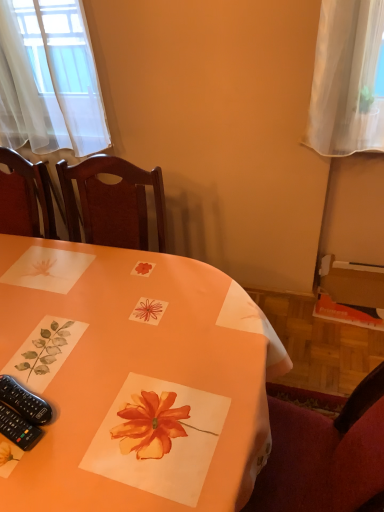
Where is `free space to the right of black plastic remote control at lower left, which is counted as the first remote control, starting from the top`? The image size is (384, 512). free space to the right of black plastic remote control at lower left, which is counted as the first remote control, starting from the top is located at coordinates (100, 397).